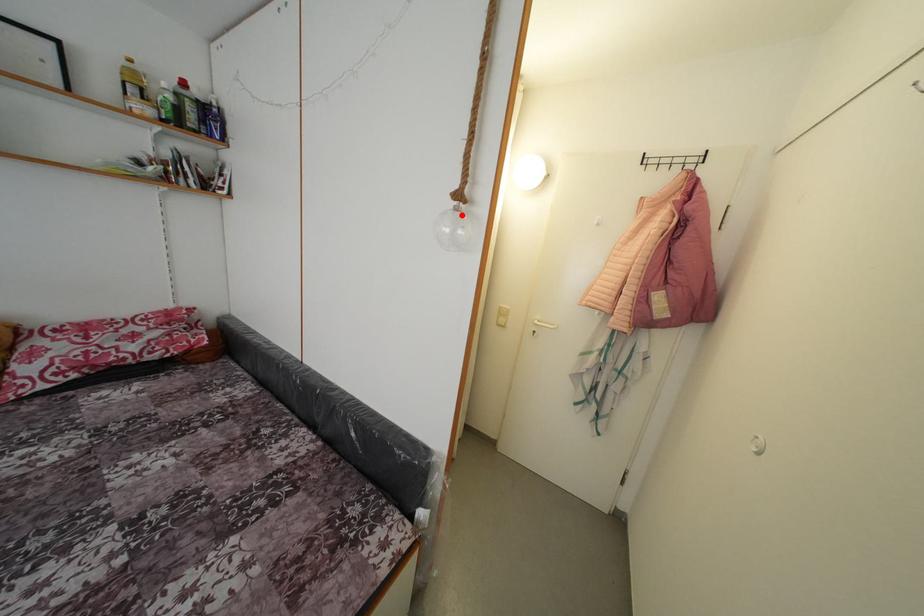
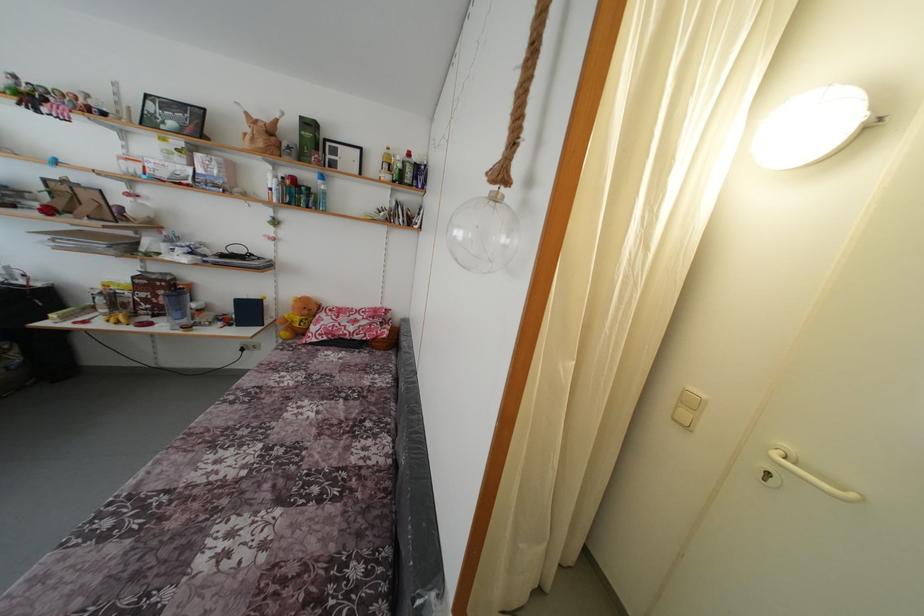
In the second image, find the point that corresponds to the highlighted location in the first image.

(500, 204)